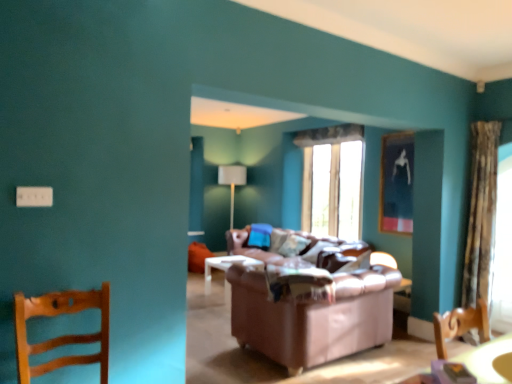
The height and width of the screenshot is (384, 512). Identify the location of white fabric lampshade at center. (232, 182).

The image size is (512, 384). What do you see at coordinates (332, 180) in the screenshot?
I see `transparent glass window at center` at bounding box center [332, 180].

What is the approximate height of transparent glass window at center?

The height of transparent glass window at center is 1.43 meters.

At what (x,y) coordinates should I click in order to perform the action: click on white fabric lampshade at center. Please return your answer as a coordinate pair (x, y). The height and width of the screenshot is (384, 512). Looking at the image, I should click on (232, 182).

Is wooden chair at left shorter than metallic silver picture frame at upper right?

Correct, wooden chair at left is not as tall as metallic silver picture frame at upper right.

Is wooden chair at left thinner than metallic silver picture frame at upper right?

No.

Would you say wooden chair at left is inside or outside metallic silver picture frame at upper right?

wooden chair at left exists outside the volume of metallic silver picture frame at upper right.

Could you tell me if wooden chair at left is turned towards metallic silver picture frame at upper right?

No, wooden chair at left is not oriented towards metallic silver picture frame at upper right.

Which is behind, white fabric lampshade at center or metallic silver picture frame at upper right?

white fabric lampshade at center.

Looking at this image, considering the sizes of objects white fabric lampshade at center and metallic silver picture frame at upper right in the image provided, who is wider, white fabric lampshade at center or metallic silver picture frame at upper right?

With larger width is white fabric lampshade at center.

You are a GUI agent. You are given a task and a screenshot of the screen. Output one action in this format:
    pyautogui.click(x=<x>, y=<y>)
    Task: Click on the picture frame above the white fabric lampshade at center (from a real-world perspective)
    This screenshot has height=384, width=512.
    Given the screenshot: What is the action you would take?
    pyautogui.click(x=397, y=183)

Is white fabric lampshade at center positioned far away from metallic silver picture frame at upper right?

white fabric lampshade at center is positioned a significant distance from metallic silver picture frame at upper right.

Which object is further away from the camera taking this photo, white fabric lampshade at center or brown leather couch at center?

white fabric lampshade at center is behind.

From the image's perspective, who appears lower, white fabric lampshade at center or brown leather couch at center?

brown leather couch at center, from the image's perspective.

Where is `studio couch beneath the white fabric lampshade at center (from a real-world perspective)`? studio couch beneath the white fabric lampshade at center (from a real-world perspective) is located at coordinates (315, 312).

Is white fabric lampshade at center beside brown leather couch at center?

No, white fabric lampshade at center is not beside brown leather couch at center.

How different are the orientations of brown leather couch at center and white fabric lampshade at center in degrees?

The facing directions of brown leather couch at center and white fabric lampshade at center are 176 degrees apart.

From the picture: Between brown leather couch at center and white fabric lampshade at center, which one appears on the right side from the viewer's perspective?

Positioned to the right is brown leather couch at center.

In the scene shown: From the image's perspective, relative to white fabric lampshade at center, is brown leather couch at center above or below?

Based on their image positions, brown leather couch at center is located beneath white fabric lampshade at center.

From a real-world perspective, is brown leather couch at center above or below white fabric lampshade at center?

From a real-world perspective, brown leather couch at center is physically below white fabric lampshade at center.

Based on the photo, are wooden chair at left and transparent glass window at center beside each other?

No, wooden chair at left is not making contact with transparent glass window at center.

Between point (82, 358) and point (334, 129), which one is positioned behind?

The point (334, 129) is farther.

Does wooden chair at left have a lesser width compared to transparent glass window at center?

No, wooden chair at left is not thinner than transparent glass window at center.

Is wooden chair at left shorter than transparent glass window at center?

Correct, wooden chair at left is not as tall as transparent glass window at center.

Can you confirm if wooden chair at left is thinner than brown leather couch at center?

Yes, wooden chair at left is thinner than brown leather couch at center.

Locate an element on the screen. This screenshot has width=512, height=384. chair located in front of the brown leather couch at center is located at coordinates (61, 336).

Could you tell me if wooden chair at left is facing brown leather couch at center?

No, wooden chair at left does not turn towards brown leather couch at center.

Is wooden chair at left directly adjacent to brown leather couch at center?

No, wooden chair at left is not beside brown leather couch at center.

Considering the points (403, 188) and (101, 329), which point is behind, point (403, 188) or point (101, 329)?

Point (403, 188)

Is metallic silver picture frame at upper right inside the boundaries of wooden chair at left, or outside?

metallic silver picture frame at upper right is spatially situated outside wooden chair at left.

From the image's perspective, is metallic silver picture frame at upper right located above or below wooden chair at left?

metallic silver picture frame at upper right is situated higher than wooden chair at left in the image.

The width and height of the screenshot is (512, 384). What are the coordinates of `picture frame above the wooden chair at left (from a real-world perspective)` in the screenshot? It's located at (397, 183).

At what (x,y) coordinates should I click in order to perform the action: click on lamp below the metallic silver picture frame at upper right (from a real-world perspective). Please return your answer as a coordinate pair (x, y). Image resolution: width=512 pixels, height=384 pixels. Looking at the image, I should click on (232, 182).

Looking at the image, which one is located further to white fabric lampshade at center, brown leather couch at center or transparent fabric at right?

The object further to white fabric lampshade at center is transparent fabric at right.

When comparing their distances from metallic silver picture frame at upper right, does white fabric lampshade at center or wooden chair at left seem closer?

The object closer to metallic silver picture frame at upper right is white fabric lampshade at center.

From the image, which object appears to be farther from brown leather couch at center, transparent glass window at center or transparent fabric at right?

transparent fabric at right is further to brown leather couch at center.

Estimate the real-world distances between objects in this image. Which object is closer to patterned fabric curtain at right, brown leather couch at center or transparent glass window at center?

brown leather couch at center lies closer to patterned fabric curtain at right than the other object.

Consider the image. Estimate the real-world distances between objects in this image. Which object is further from metallic silver picture frame at upper right, transparent glass window at center or white fabric lampshade at center?

white fabric lampshade at center is positioned further to the anchor metallic silver picture frame at upper right.

Looking at the image, which one is located closer to brown leather couch at center, metallic silver picture frame at upper right or patterned fabric curtain at right?

metallic silver picture frame at upper right is positioned closer to the anchor brown leather couch at center.

When comparing their distances from patterned fabric curtain at right, does metallic silver picture frame at upper right or transparent fabric at right seem closer?

Based on the image, transparent fabric at right appears to be nearer to patterned fabric curtain at right.

Estimate the real-world distances between objects in this image. Which object is further from transparent fabric at right, wooden chair at left or white fabric lampshade at center?

white fabric lampshade at center is further to transparent fabric at right.

You are a GUI agent. You are given a task and a screenshot of the screen. Output one action in this format:
    pyautogui.click(x=<x>, y=<y>)
    Task: Click on the curtain positioned between wooden chair at left and metallic silver picture frame at upper right from near to far
    The height and width of the screenshot is (384, 512).
    Given the screenshot: What is the action you would take?
    pyautogui.click(x=481, y=211)

Where is `picture frame between brown leather couch at center and transparent glass window at center along the z-axis`? This screenshot has width=512, height=384. picture frame between brown leather couch at center and transparent glass window at center along the z-axis is located at coordinates (397, 183).

You are a GUI agent. You are given a task and a screenshot of the screen. Output one action in this format:
    pyautogui.click(x=<x>, y=<y>)
    Task: Click on the curtain situated between wooden chair at left and transparent fabric at right from left to right
    
    Given the screenshot: What is the action you would take?
    pyautogui.click(x=481, y=211)

This screenshot has height=384, width=512. Find the location of `window screen positioned between patterned fabric curtain at right and metallic silver picture frame at upper right from near to far`. window screen positioned between patterned fabric curtain at right and metallic silver picture frame at upper right from near to far is located at coordinates (503, 247).